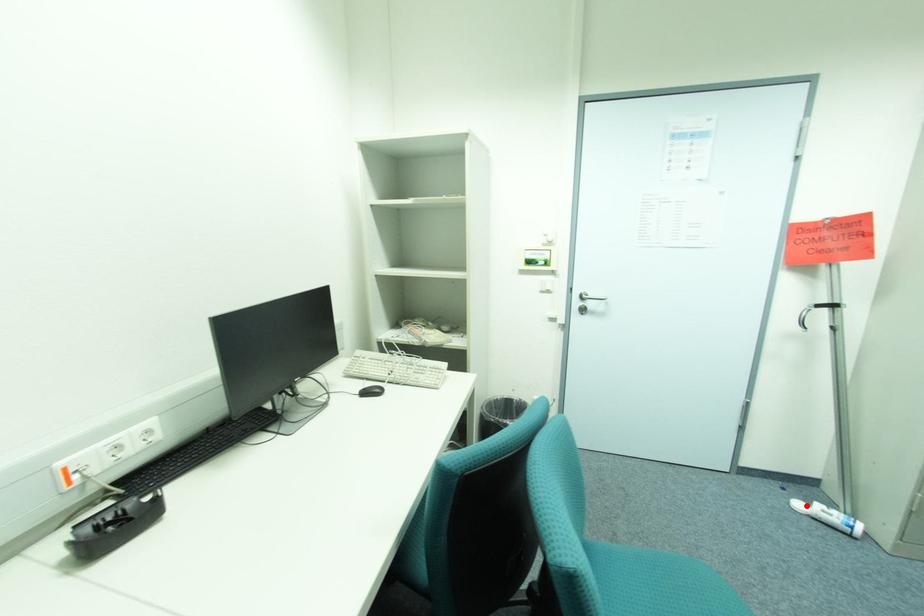
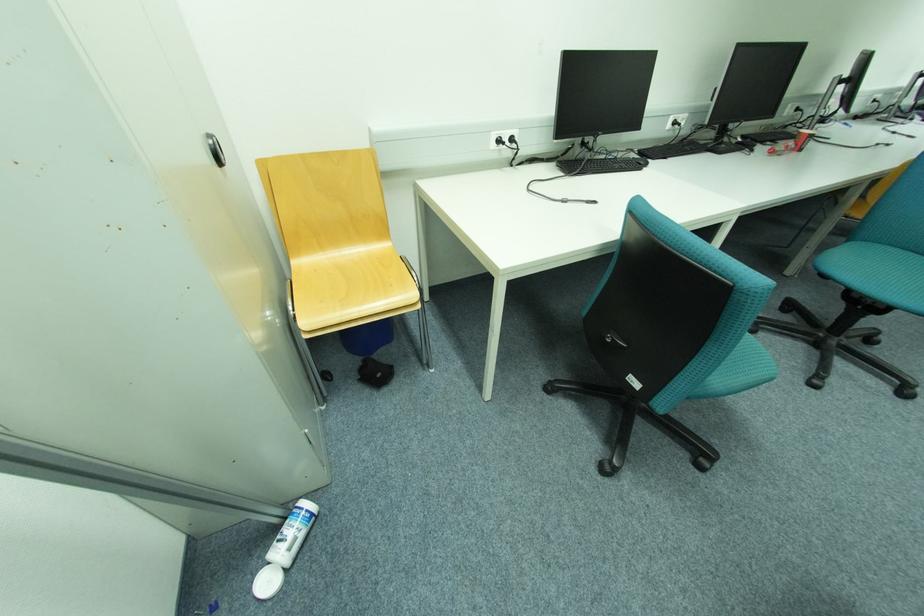
In the second image, find the point that corresponds to the highlighted location in the first image.

(274, 584)